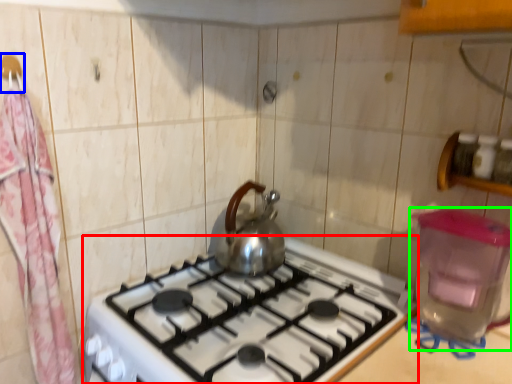
Question: Based on their relative distances, which object is farther from gas stove (highlighted by a red box)? Choose from hanger (highlighted by a blue box) and water heater (highlighted by a green box).

Choices:
 (A) hanger
 (B) water heater

Answer: (A)